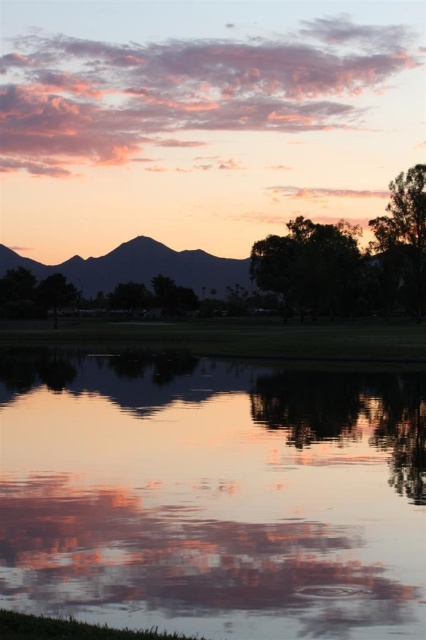
How much distance is there between green leafy tree at upper right and green matte tree at left?

green leafy tree at upper right and green matte tree at left are 29.49 meters apart from each other.

Which of these two, green leafy tree at upper right or green matte tree at left, stands shorter?

With less height is green matte tree at left.

Is point (359, 301) closer to viewer compared to point (62, 280)?

No, (359, 301) is further to viewer.

Find the location of a particular element. This screenshot has height=640, width=426. green leafy tree at upper right is located at coordinates (351, 259).

Does silvery metallic mountain at center appear under green matte tree at left?

No, silvery metallic mountain at center is not below green matte tree at left.

Does silvery metallic mountain at center have a larger size compared to green matte tree at left?

Yes.

Between point (196, 259) and point (74, 292), which one is positioned in front?

Point (74, 292) is more forward.

This screenshot has height=640, width=426. Identify the location of silvery metallic mountain at center. (141, 268).

How far apart are green leafy tree at center and green matte tree at left?

green leafy tree at center is 26.23 meters away from green matte tree at left.

At what (x,y) coordinates should I click in order to perform the action: click on green leafy tree at center. Please return your answer as a coordinate pair (x, y). This screenshot has height=640, width=426. Looking at the image, I should click on (310, 268).

I want to click on green leafy tree at center, so click(310, 268).

Find the location of `green leafy tree at center`. green leafy tree at center is located at coordinates (310, 268).